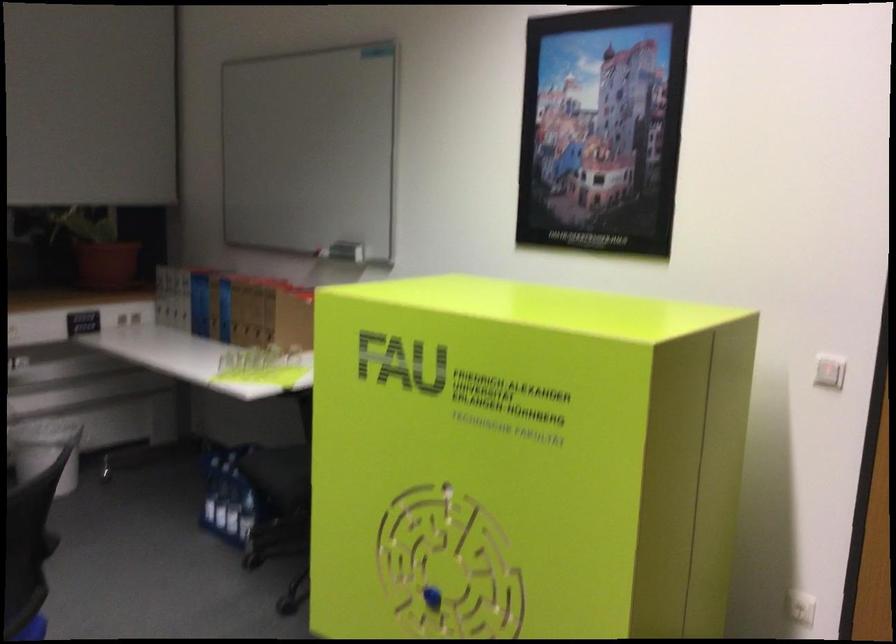
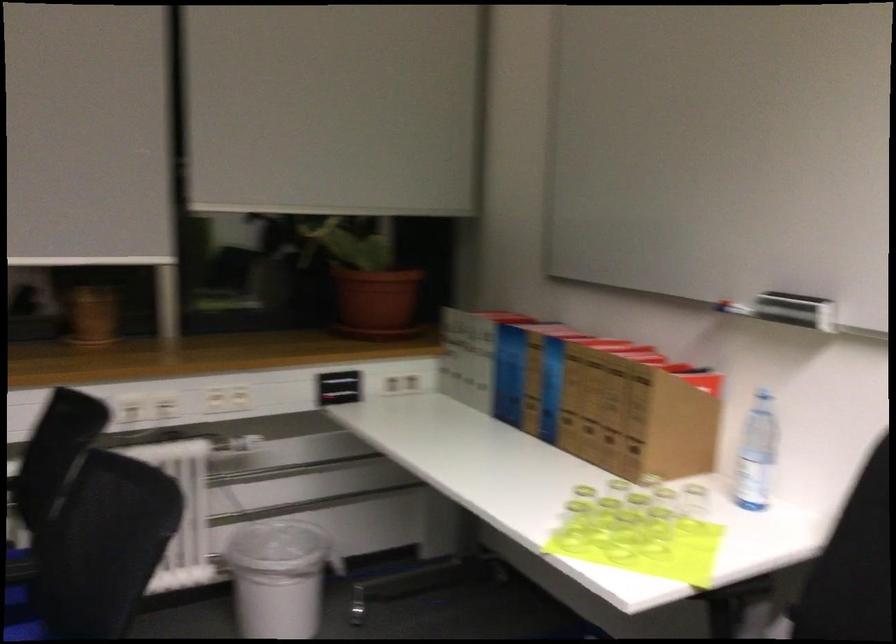
Find the pixel in the second image that matches the point at 204,305 in the first image.

(509, 374)